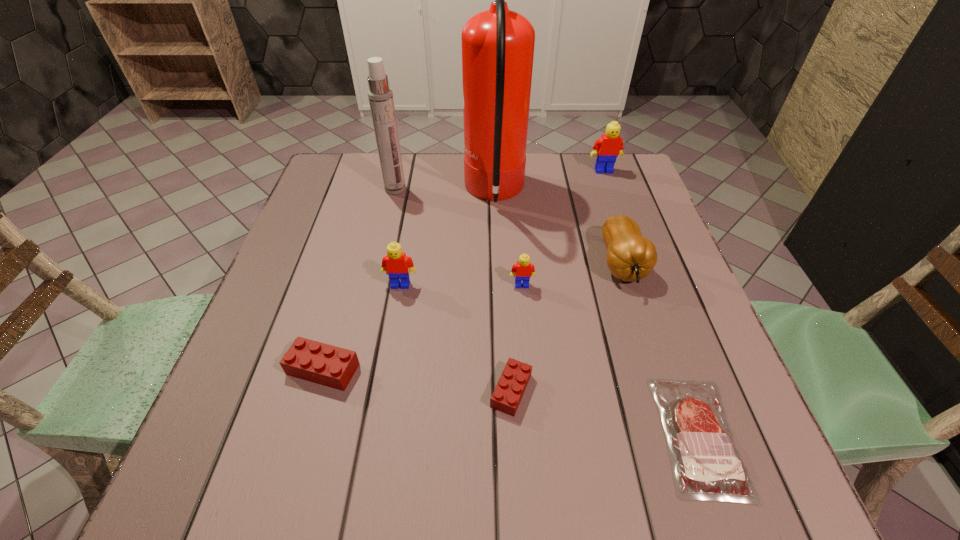
The height and width of the screenshot is (540, 960). What are the coordinates of `free space located 0.320m on the front-facing side of the tallest Lego` in the screenshot? It's located at (632, 248).

You are a GUI agent. You are given a task and a screenshot of the screen. Output one action in this format:
    pyautogui.click(x=<x>, y=<y>)
    Task: Click on the free space located 0.220m on the front-facing side of the second smallest yellow Lego
    
    Given the screenshot: What is the action you would take?
    pyautogui.click(x=385, y=378)

Where is `vacant region located on the stem side of the gourd`? The image size is (960, 540). vacant region located on the stem side of the gourd is located at coordinates (689, 476).

I want to click on blank space located on the front-facing side of the second yellow Lego from right to left, so click(x=529, y=363).

Where is `free space located 0.120m on the back of the seventh tallest object`? This screenshot has width=960, height=540. free space located 0.120m on the back of the seventh tallest object is located at coordinates tap(343, 302).

In order to click on free region located 0.220m on the right of the eighth tallest object in this screenshot , I will do `click(656, 391)`.

Where is `free location located on the back of the steak`? free location located on the back of the steak is located at coordinates coord(632,247).

Where is `fire extinguisher at the far edge`? This screenshot has width=960, height=540. fire extinguisher at the far edge is located at coordinates (497, 44).

Where is `aerosol can that is positioned at the far edge`? The width and height of the screenshot is (960, 540). aerosol can that is positioned at the far edge is located at coordinates (380, 95).

Image resolution: width=960 pixels, height=540 pixels. I want to click on Lego that is at the far edge, so click(607, 148).